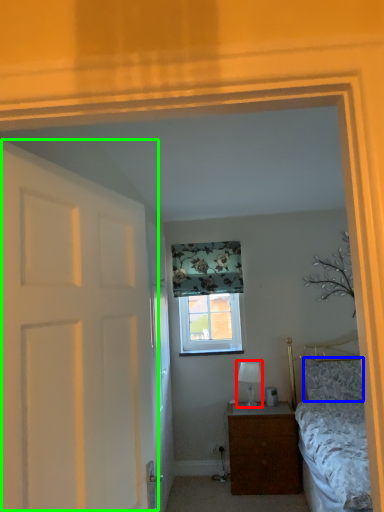
Question: Estimate the real-world distances between objects in this image. Which object is closer to table lamp (highlighted by a red box), pillow (highlighted by a blue box) or door (highlighted by a green box)?

Choices:
 (A) pillow
 (B) door

Answer: (A)